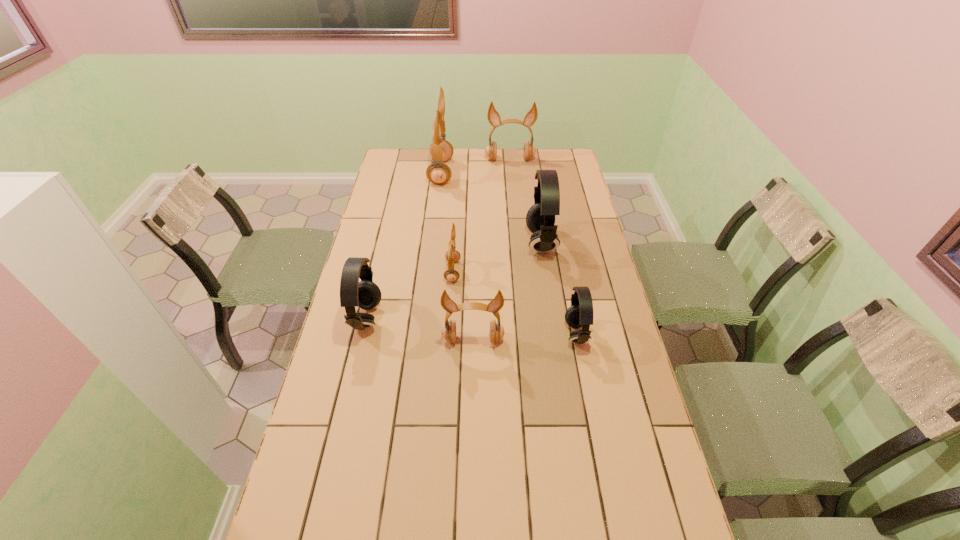
The width and height of the screenshot is (960, 540). Find the location of `object situated at the left edge`. object situated at the left edge is located at coordinates (365, 294).

Locate an element on the screen. vacant space at the far edge of the desktop is located at coordinates (455, 153).

This screenshot has height=540, width=960. Find the location of `free space at the left edge of the desktop`. free space at the left edge of the desktop is located at coordinates (381, 251).

In the image, there is a desktop. Where is `free region at the right edge`? This screenshot has width=960, height=540. free region at the right edge is located at coordinates (575, 189).

In the image, there is a desktop. Where is `vacant space at the far right corner`? vacant space at the far right corner is located at coordinates (562, 153).

Find the location of `blank region between the third biggest brown earphone and the third smallest brown earphone`. blank region between the third biggest brown earphone and the third smallest brown earphone is located at coordinates (492, 249).

At what (x,y) coordinates should I click in order to perform the action: click on unoccupied position between the nearest brown earphone and the second biggest brown earphone. Please return your answer as a coordinate pair (x, y). The height and width of the screenshot is (540, 960). Looking at the image, I should click on (492, 249).

Locate an element on the screen. blank region between the farthest black earphone and the smallest black earphone is located at coordinates (559, 288).

Locate an element on the screen. The width and height of the screenshot is (960, 540). free area in between the farthest black earphone and the tallest earphone is located at coordinates (491, 207).

Locate an element on the screen. This screenshot has width=960, height=540. free spot between the smallest black earphone and the leftmost black earphone is located at coordinates pyautogui.click(x=471, y=327).